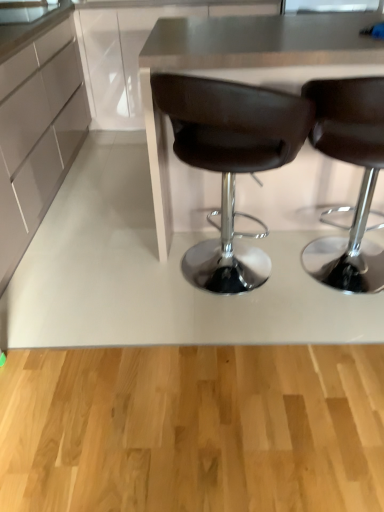
Image resolution: width=384 pixels, height=512 pixels. Find the location of `free space in front of brown leather chair at center, placed as the first chair when sorted from left to right`. free space in front of brown leather chair at center, placed as the first chair when sorted from left to right is located at coordinates (238, 352).